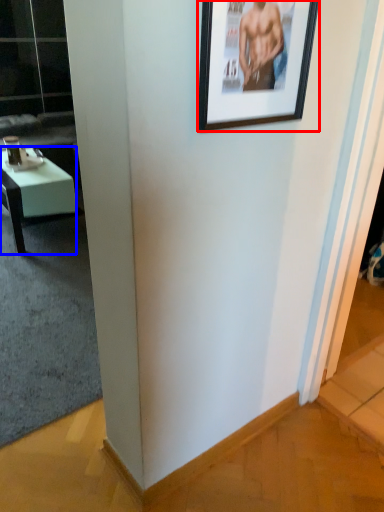
Question: Which point is closer to the camera, picture frame (highlighted by a red box) or desk (highlighted by a blue box)?

Choices:
 (A) picture frame
 (B) desk

Answer: (A)